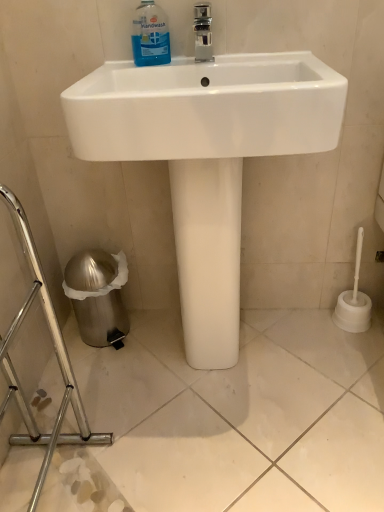
Question: Is blue translucent liquid at upper center to the right of silver metallic trash can at lower left from the viewer's perspective?

Choices:
 (A) yes
 (B) no

Answer: (A)

Question: Can silver metallic trash can at lower left be found inside blue translucent liquid at upper center?

Choices:
 (A) no
 (B) yes

Answer: (A)

Question: Is blue translucent liquid at upper center closer to camera compared to silver metallic trash can at lower left?

Choices:
 (A) yes
 (B) no

Answer: (B)

Question: Is blue translucent liquid at upper center smaller than silver metallic trash can at lower left?

Choices:
 (A) no
 (B) yes

Answer: (B)

Question: Can you confirm if blue translucent liquid at upper center is shorter than silver metallic trash can at lower left?

Choices:
 (A) yes
 (B) no

Answer: (A)

Question: Does blue translucent liquid at upper center have a greater width compared to silver metallic trash can at lower left?

Choices:
 (A) no
 (B) yes

Answer: (A)

Question: Can you confirm if blue translucent liquid at upper center is taller than white glossy sink at center?

Choices:
 (A) yes
 (B) no

Answer: (B)

Question: Considering the relative sizes of blue translucent liquid at upper center and white glossy sink at center in the image provided, is blue translucent liquid at upper center smaller than white glossy sink at center?

Choices:
 (A) yes
 (B) no

Answer: (A)

Question: Can you confirm if blue translucent liquid at upper center is wider than white glossy sink at center?

Choices:
 (A) yes
 (B) no

Answer: (B)

Question: Is blue translucent liquid at upper center not within white glossy sink at center?

Choices:
 (A) no
 (B) yes

Answer: (A)

Question: Is white glossy sink at center surrounded by blue translucent liquid at upper center?

Choices:
 (A) no
 (B) yes

Answer: (A)

Question: Is blue translucent liquid at upper center at the left side of white glossy sink at center?

Choices:
 (A) no
 (B) yes

Answer: (B)

Question: Could you tell me if white glossy sink at center is facing silver metallic trash can at lower left?

Choices:
 (A) yes
 (B) no

Answer: (B)